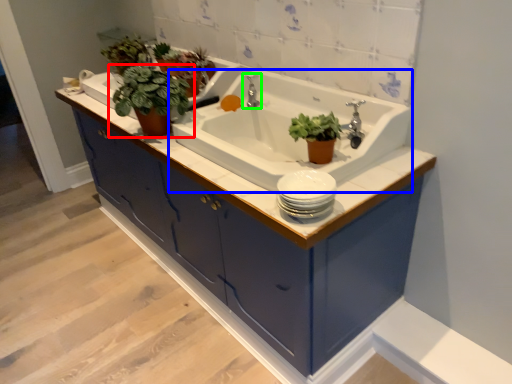
Question: Which object is positioned closest to houseplant (highlighted by a red box)? Select from sink (highlighted by a blue box) and tap (highlighted by a green box).

Choices:
 (A) sink
 (B) tap

Answer: (A)